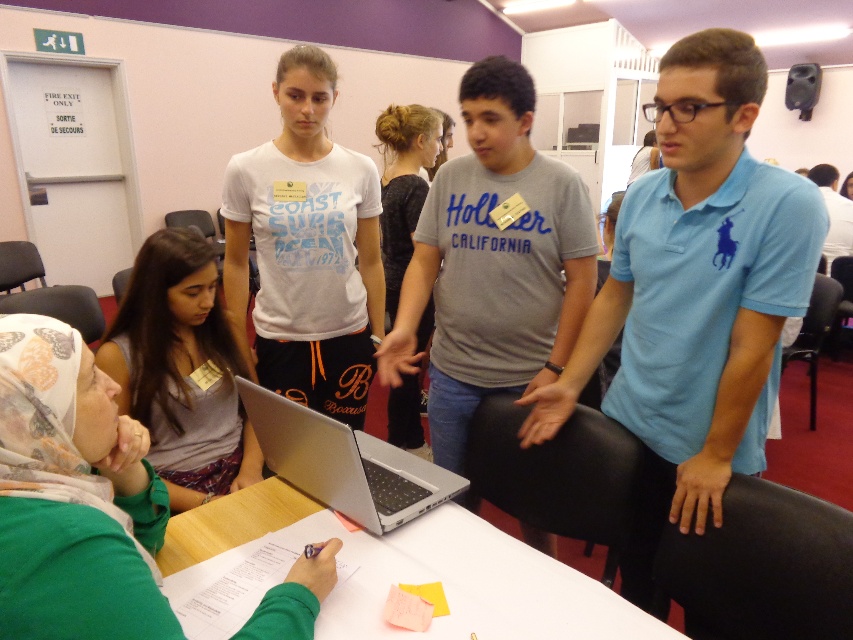
You are organizing a small workshop in a room with a modern design and purple walls. You have a matte gray laptop at center and a white paper at center on a table. If you want to place a 12 inch wide notebook between them, will there be enough space?

The distance between the matte gray laptop at center and the white paper at center is 11.31 inches. Since the notebook is 12 inches wide, it won not fit between them as the space is slightly narrower than the notebook.

You are standing at the entrance of the room and want to place a new object at the exact center of the room. The room is a rectangle with coordinates from 0 to 1 on both axes. The existing object is the matte gray laptop at center located at point 0.778, 0.084. What coordinates should you use to place the new object so it is exactly at the center of the room?

The center of the room is at coordinates (426, 320). The existing matte gray laptop at center is located at (71, 497), so to place the new object exactly at the center, you should use coordinates (426, 320).